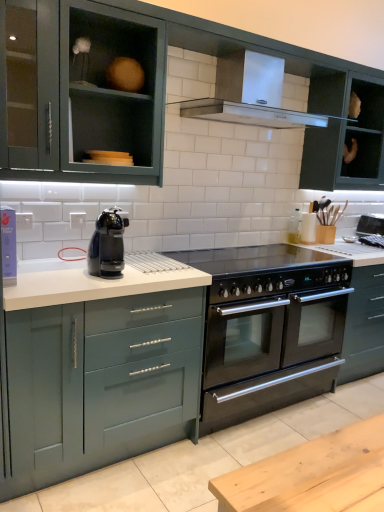
The height and width of the screenshot is (512, 384). In order to click on vacant region below black plastic coffee machine at center (from a real-world perspective) in this screenshot , I will do `click(119, 273)`.